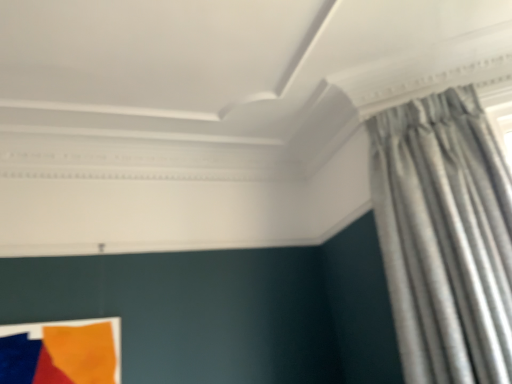
Locate an element on the screen. Image resolution: width=512 pixels, height=384 pixels. silvery textured curtain at upper right is located at coordinates (445, 237).

What do you see at coordinates (445, 237) in the screenshot? I see `silvery textured curtain at upper right` at bounding box center [445, 237].

The image size is (512, 384). Find the location of `silvery textured curtain at upper right`. silvery textured curtain at upper right is located at coordinates (445, 237).